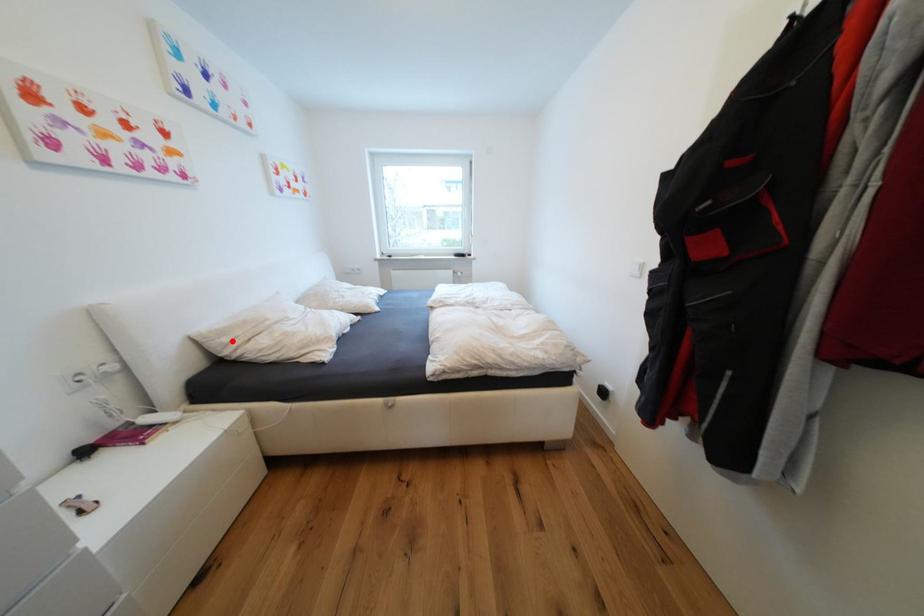
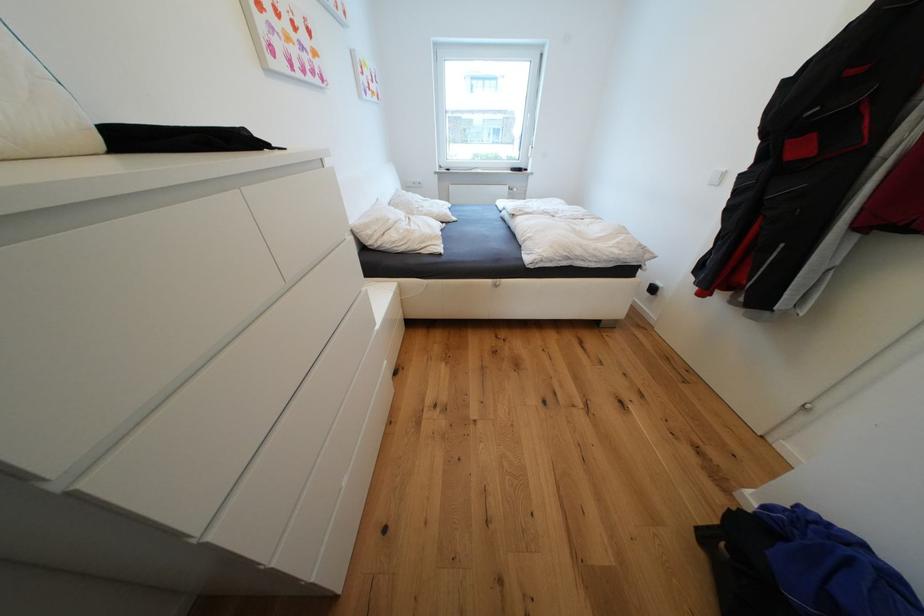
Question: A red point is marked in image1. In image2, is the corresponding 3D point closer to the camera or farther? Reply with the corresponding letter.

Choices:
 (A) The corresponding 3D point is closer.
 (B) The corresponding 3D point is farther.

Answer: (A)